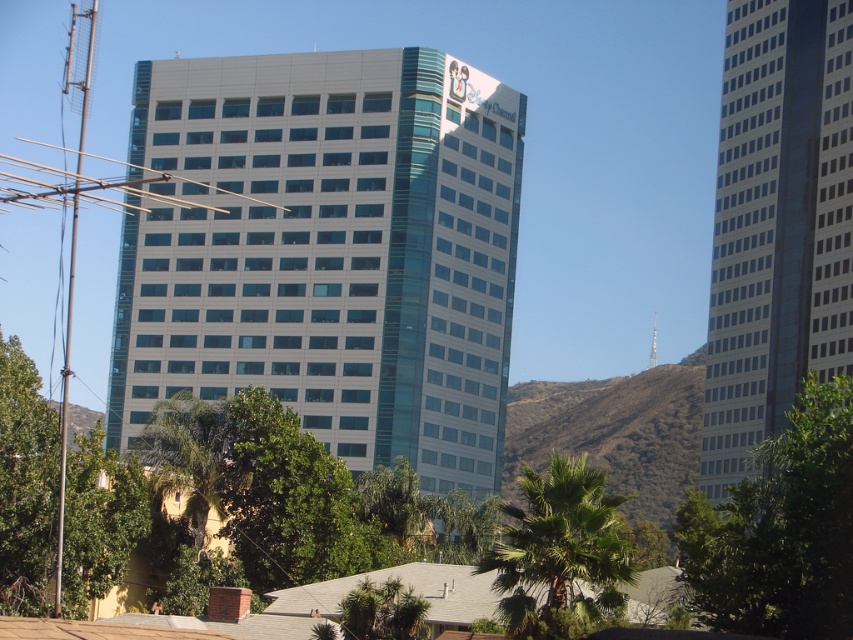
How much distance is there between matte glass building at center and glassy white skyscraper at right?

39.21 meters

Is matte glass building at center above glassy white skyscraper at right?

No, matte glass building at center is not above glassy white skyscraper at right.

Where is `matte glass building at center`? The width and height of the screenshot is (853, 640). matte glass building at center is located at coordinates (329, 252).

Find the location of a particular element. matte glass building at center is located at coordinates (329, 252).

Is matte glass building at center taller than green leafy tree at lower left?

Yes.

Which is below, matte glass building at center or green leafy tree at lower left?

green leafy tree at lower left

Is point (258, 86) positioned in front of point (86, 504)?

That is False.

This screenshot has height=640, width=853. Find the location of `matte glass building at center`. matte glass building at center is located at coordinates point(329,252).

Is point (811, 237) closer to viewer compared to point (131, 547)?

No, it is not.

Does glassy white skyscraper at right have a greater height compared to green leafy tree at lower left?

Yes.

Locate an element on the screen. Image resolution: width=853 pixels, height=640 pixels. glassy white skyscraper at right is located at coordinates (776, 224).

Identify the location of glassy white skyscraper at right. The width and height of the screenshot is (853, 640). (776, 224).